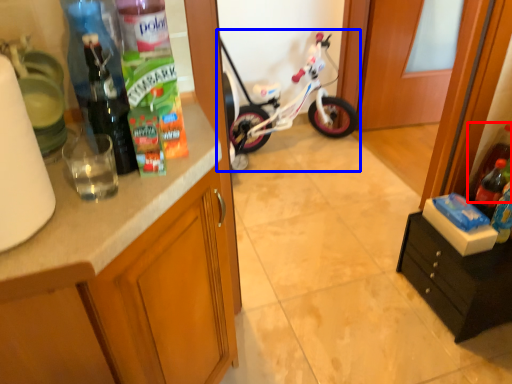
Question: Which object appears closest to the camera in this image, bottle (highlighted by a red box) or bicycle (highlighted by a blue box)?

Choices:
 (A) bottle
 (B) bicycle

Answer: (A)